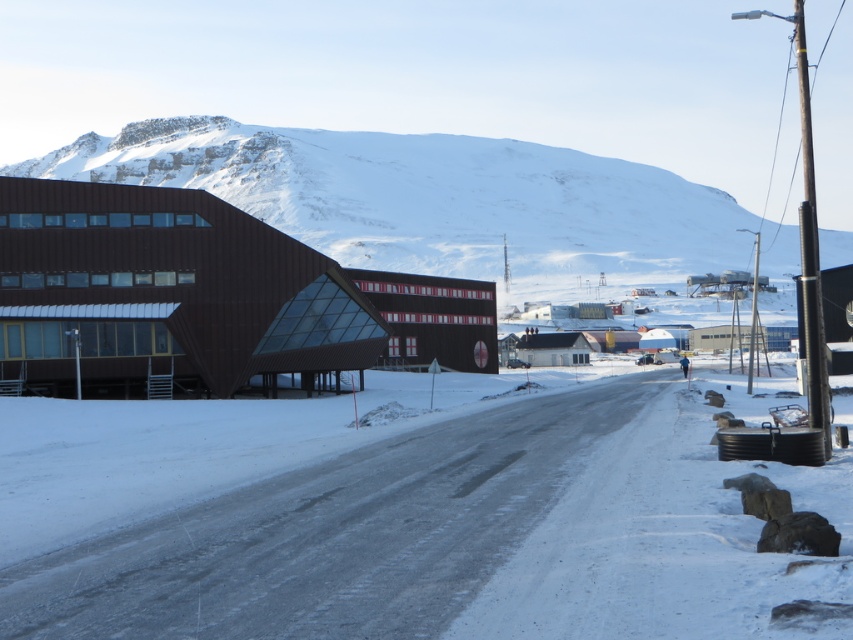
You are standing in front of the large modern building with a dark brown facade and triangular glass section. You see the white powdery snow at center and the snowy mountain at upper center. Which object is located to the right of the other?

The white powdery snow at center is positioned on the right side of snowy mountain at upper center.

Consider the image. You are an architect designing a new ski resort. You need to determine where to place the main lodge. The white powdery snow at center and the snowy mountain at upper center are both visible from the proposed site. Which of these two landmarks is closer to the ground level?

The white powdery snow at center has a lesser height compared to the snowy mountain at upper center, so the white powdery snow at center is closer to the ground level.

You are standing at the point marked by point (450, 540) in the snowy landscape. What is the terrain like under your feet?

The white powdery snow at center is represented by point (450, 540), so the terrain under your feet is covered in white powdery snow.